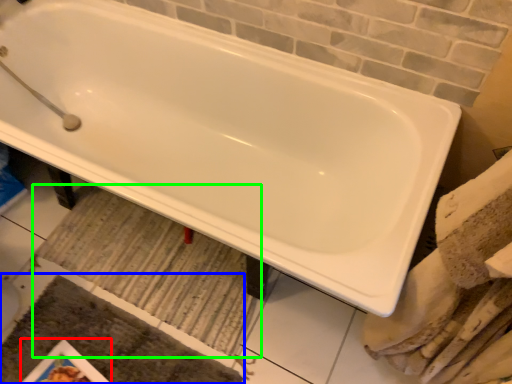
Question: Which object is the farthest from magazine (highlighted by a red box)? Choose among these: bath mat (highlighted by a blue box) or bath mat (highlighted by a green box).

Choices:
 (A) bath mat
 (B) bath mat

Answer: (B)